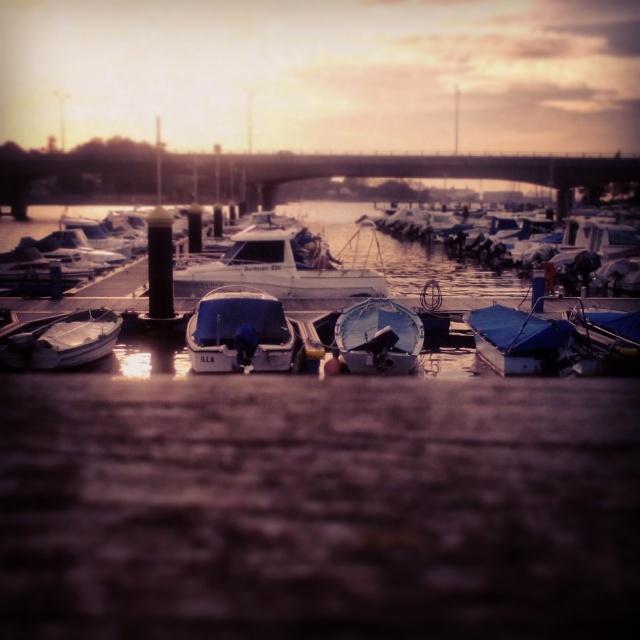
You are a photographer trying to capture the reflection of the boats in the water. You notice the white matte boat at center and the blue tarpaulin boat at center. Which boat should you focus on if you want to photograph the one that is closer to the left side of the frame?

The white matte boat at center is positioned on the left side of the blue tarpaulin boat at center, so focusing on it will capture the boat closer to the left side of the frame.

You are standing at the edge of the marina and see the blue tarpaulin boat at center. If you walk straight towards the point marked by coordinates point (522, 340), will you reach the boat?

Yes, walking straight towards the point marked by coordinates point (522, 340) will lead you directly to the blue tarpaulin boat at center because the point represents its location.